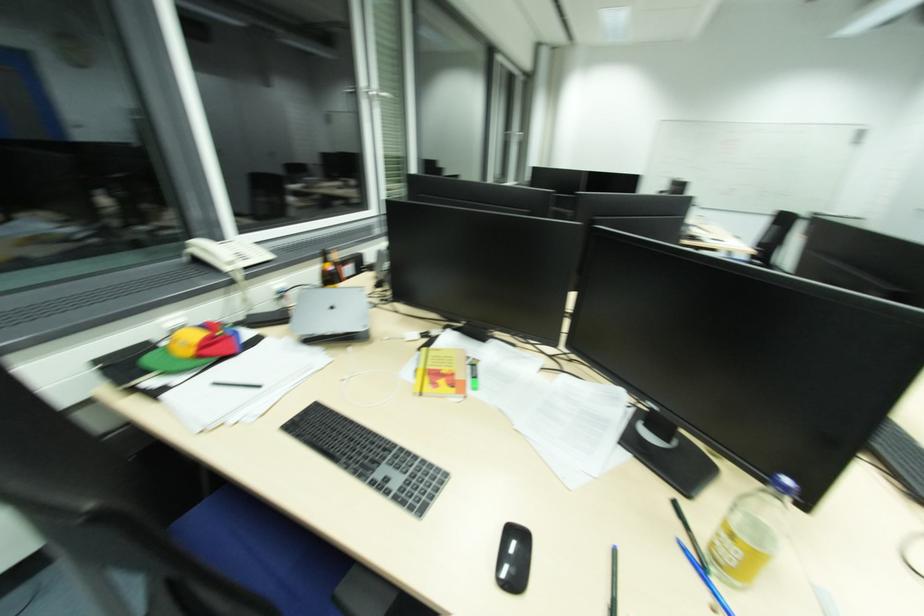
What do you see at coordinates (192, 347) in the screenshot?
I see `the colorful propeller cap` at bounding box center [192, 347].